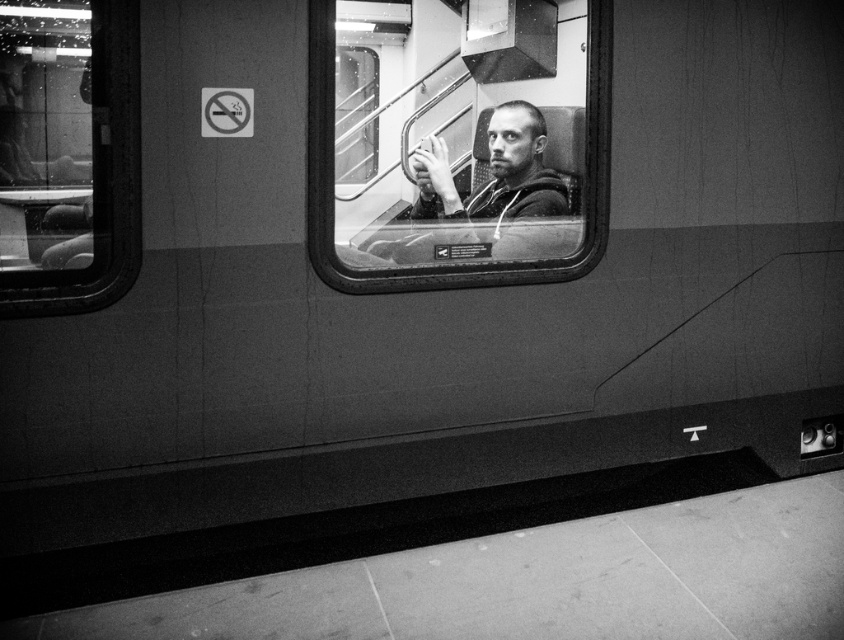
You are a passenger sitting inside the train and want to look outside through the metallic glass train window at center. Where exactly should you look to see the outside view?

The metallic glass train window at center is located at point (457, 141), so you should look towards that coordinate to see the outside view.

You are a passenger on the train and want to look outside through the window. Which object, the metallic glass train window at center or the smooth gray hoodie at center, is in front of the other?

The metallic glass train window at center is closer to the viewer than the smooth gray hoodie at center, so the metallic glass train window at center is in front of the smooth gray hoodie at center.

You are a passenger on the train and want to place your 1.5 feet wide backpack between the clear glass train window at left and the smooth gray hoodie at center. Is there enough space?

The clear glass train window at left is 4.69 feet away from the smooth gray hoodie at center. Since the backpack is 1.5 feet wide, there is sufficient space between them to place it.